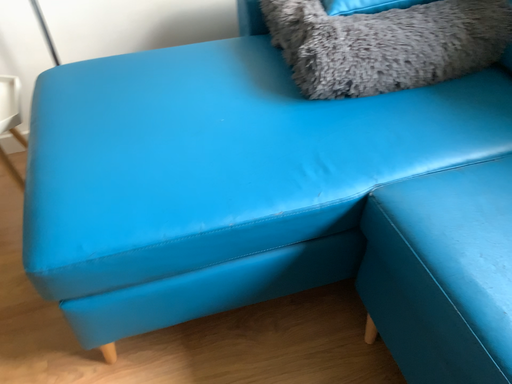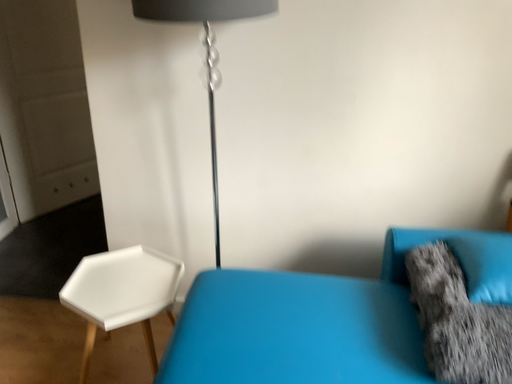
Question: Which way did the camera rotate in the video?

Choices:
 (A) rotated left
 (B) rotated right

Answer: (A)